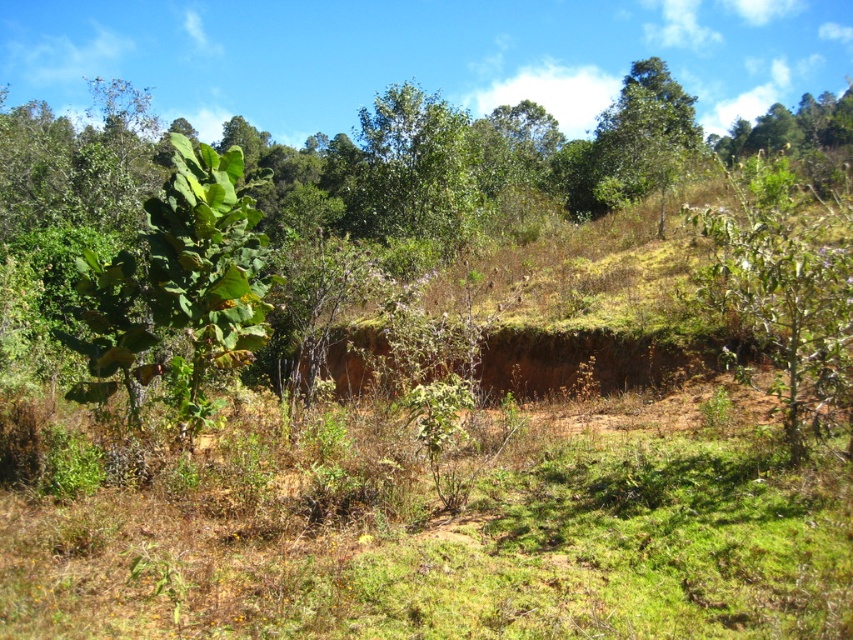
Question: In this image, where is green leafy tree at center located relative to green leafy tree at upper center?

Choices:
 (A) above
 (B) below

Answer: (B)

Question: Which of the following is the closest to the observer?

Choices:
 (A) (669, 108)
 (B) (421, 225)

Answer: (B)

Question: Which point is closer to the camera?

Choices:
 (A) coord(653,83)
 (B) coord(422,122)

Answer: (B)

Question: Is green leafy tree at center bigger than green leafy tree at upper center?

Choices:
 (A) no
 (B) yes

Answer: (A)

Question: Does green leafy tree at center appear on the left side of green leafy tree at upper center?

Choices:
 (A) yes
 (B) no

Answer: (A)